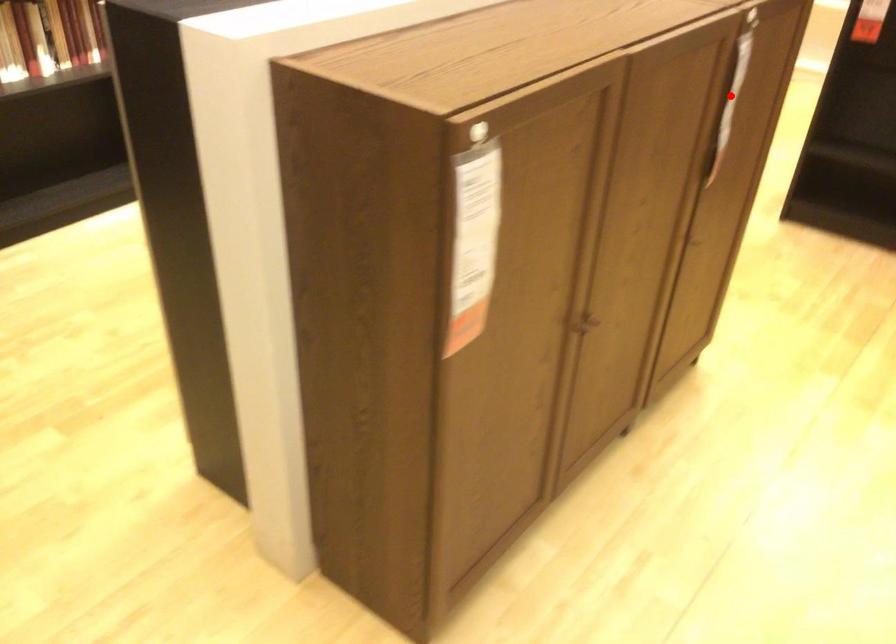
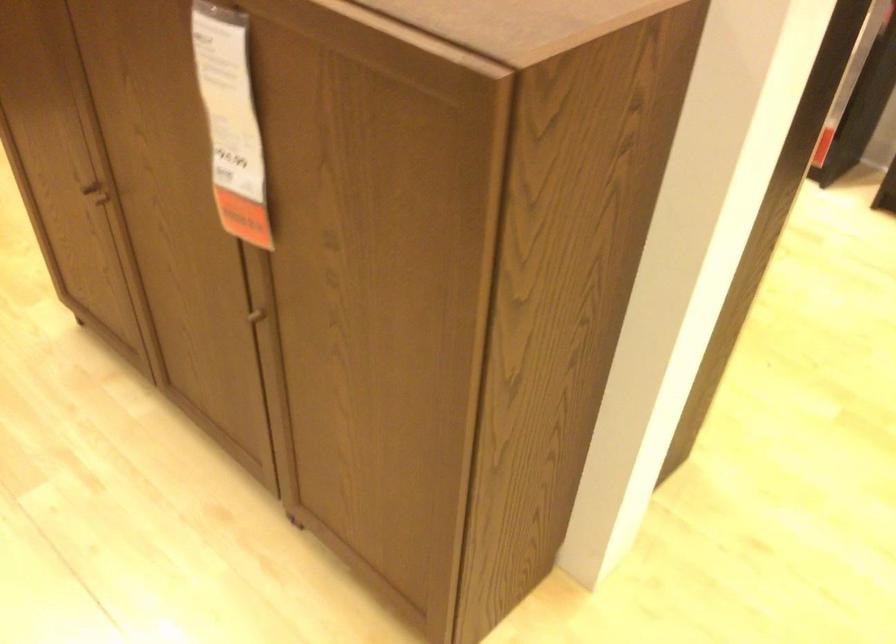
Question: I am providing you with two images of the same scene from different viewpoints. Image1 has a red point marked. In image2, the corresponding 3D location appears at what relative position? Reply with the corresponding letter.

Choices:
 (A) Closer
 (B) Farther

Answer: (A)